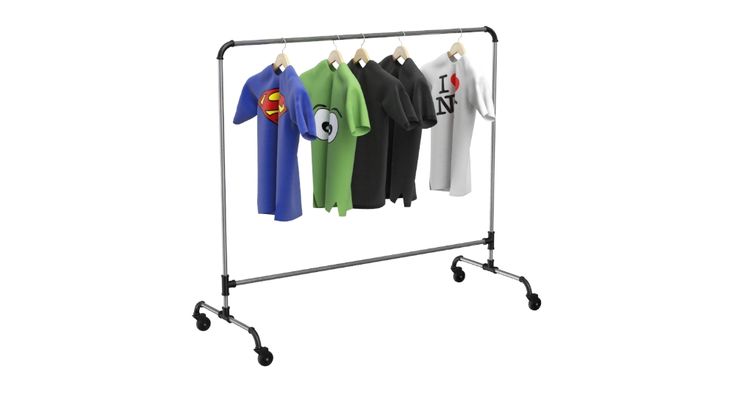
The image size is (735, 397). What are the coordinates of `clothes hanger` in the screenshot? It's located at (458, 51), (400, 53), (362, 56), (329, 55), (279, 59).